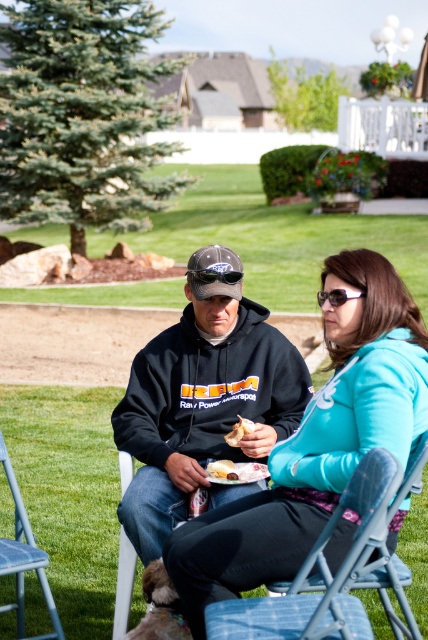
How much distance is there between matte plastic sandwich at center and golden crispy chicken at center?

4.00 inches

Who is positioned more to the right, matte plastic sandwich at center or golden crispy chicken at center?

From the viewer's perspective, matte plastic sandwich at center appears more on the right side.

The height and width of the screenshot is (640, 428). Identify the location of matte plastic sandwich at center. click(x=235, y=472).

Identify the location of matte plastic sandwich at center. (235, 472).

Can you confirm if teal fleece jacket at center is thinner than golden crispy chicken at center?

No, teal fleece jacket at center is not thinner than golden crispy chicken at center.

The width and height of the screenshot is (428, 640). I want to click on teal fleece jacket at center, so click(315, 442).

Does blue fabric chair at lower left appear under white plastic sunglasses at center?

Yes.

How distant is blue fabric chair at lower left from white plastic sunglasses at center?

The distance of blue fabric chair at lower left from white plastic sunglasses at center is 1.62 meters.

The height and width of the screenshot is (640, 428). What are the coordinates of `blue fabric chair at lower left` in the screenshot? It's located at (23, 557).